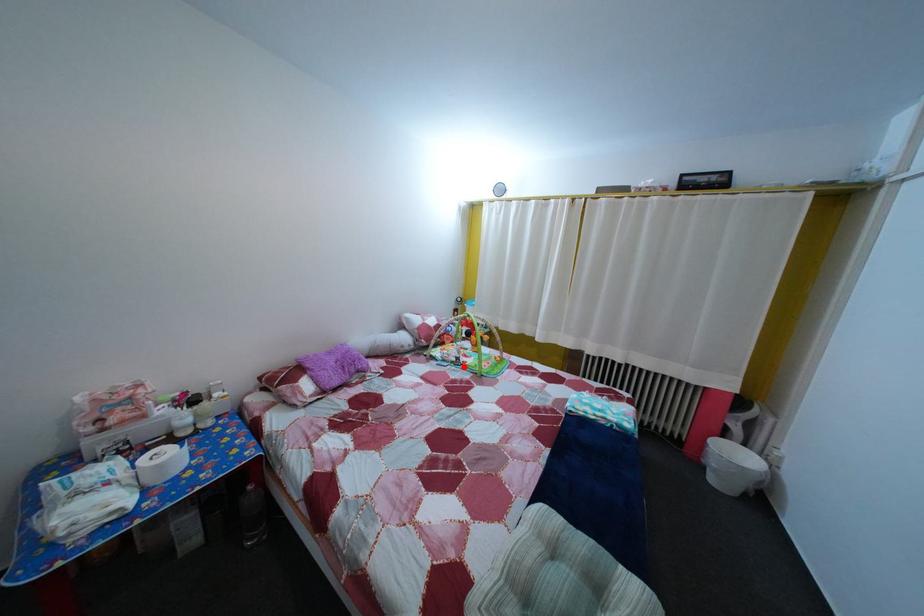
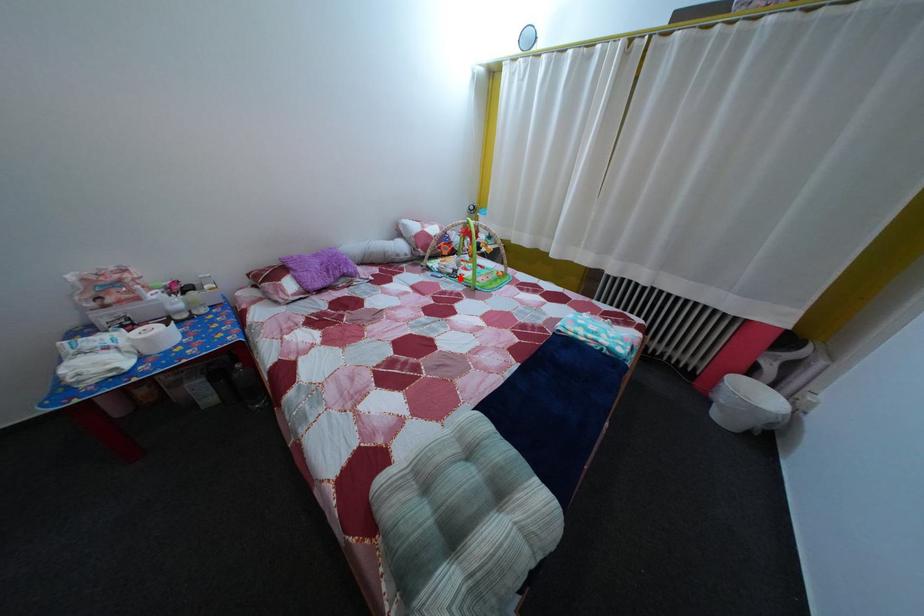
I am providing you with two images of the same scene from different viewpoints. A red point is marked on the first image and another point is marked on the second image. Is the red point in image1 aligned with the point shown in image2?

Yes